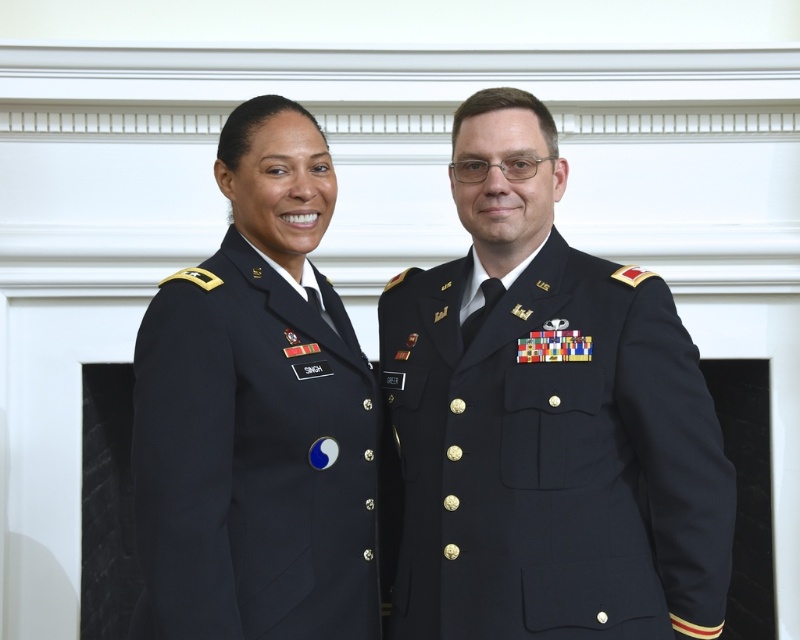
Question: In this image, where is navy blue wool military uniform at center located relative to navy blue fabric uniform at left?

Choices:
 (A) right
 (B) left

Answer: (A)

Question: Is navy blue uniform at center wider than navy blue fabric uniform at left?

Choices:
 (A) yes
 (B) no

Answer: (A)

Question: In this image, where is navy blue uniform at center located relative to navy blue wool military uniform at center?

Choices:
 (A) below
 (B) above

Answer: (B)

Question: Estimate the real-world distances between objects in this image. Which object is closer to the navy blue uniform at center?

Choices:
 (A) navy blue fabric uniform at left
 (B) navy blue wool military uniform at center

Answer: (B)

Question: Which point is farther from the camera taking this photo?

Choices:
 (A) (524, 588)
 (B) (644, 518)
 (C) (312, 484)

Answer: (B)

Question: Which of these objects is positioned closest to the navy blue wool military uniform at center?

Choices:
 (A) navy blue fabric uniform at left
 (B) navy blue uniform at center

Answer: (B)